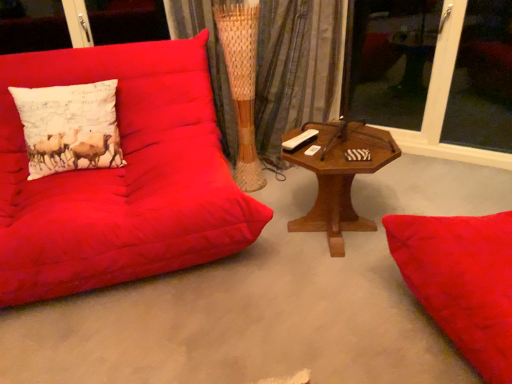
What are the coordinates of `vacant space behind transparent glass window at upper right, which ranks as the 1th window screen in right-to-left order` in the screenshot? It's located at (463, 135).